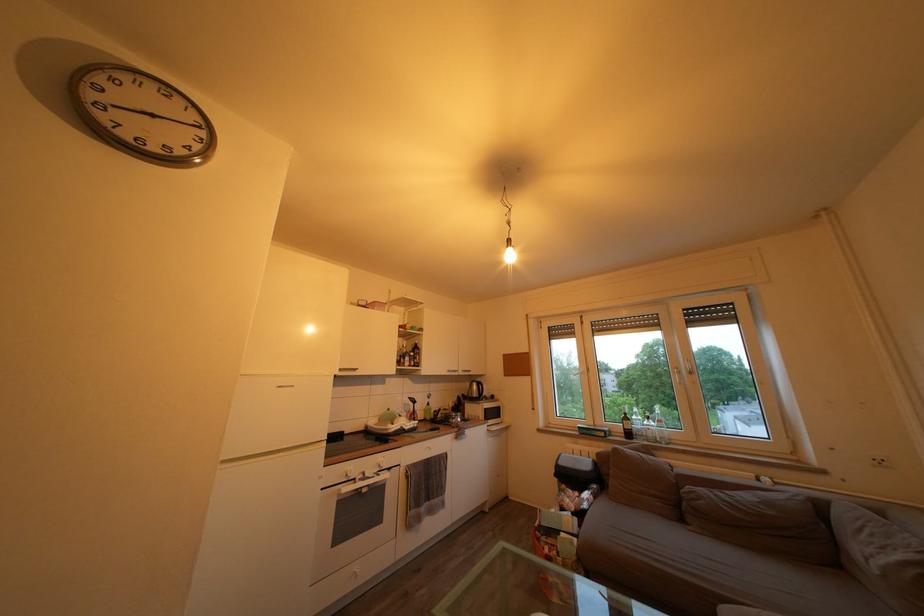
Find the location of a particular element. dark wine bottle is located at coordinates (626, 424).